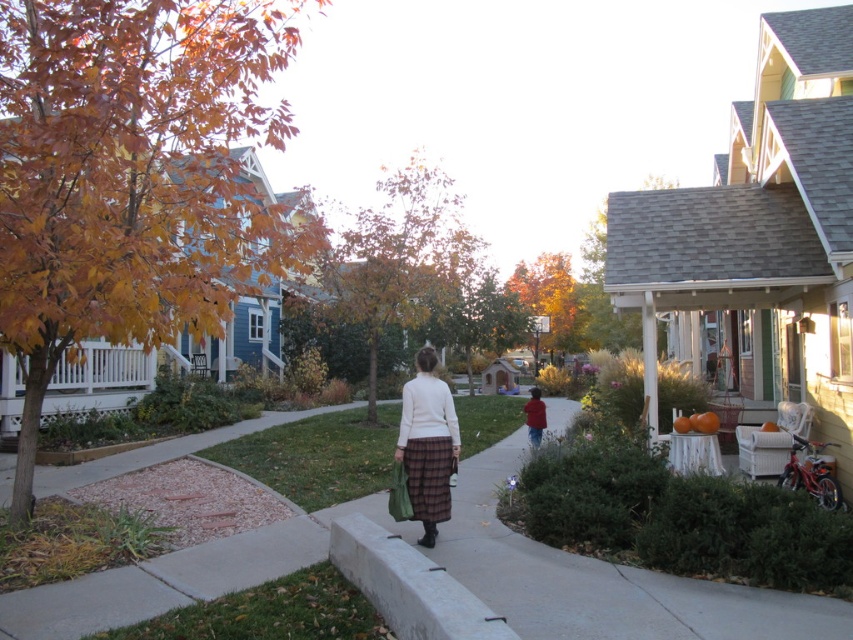
Which of these two, white concrete curb at lower center or white wool sweater at center, stands shorter?

white concrete curb at lower center is shorter.

What do you see at coordinates (408, 586) in the screenshot? I see `white concrete curb at lower center` at bounding box center [408, 586].

The height and width of the screenshot is (640, 853). I want to click on white concrete curb at lower center, so click(408, 586).

Is white concrete curb at lower center below red cotton shirt at center?

No, white concrete curb at lower center is not below red cotton shirt at center.

What do you see at coordinates (408, 586) in the screenshot? I see `white concrete curb at lower center` at bounding box center [408, 586].

Image resolution: width=853 pixels, height=640 pixels. Identify the location of white concrete curb at lower center. (408, 586).

Who is lower down, white wool sweater at center or red cotton shirt at center?

red cotton shirt at center is below.

Between white wool sweater at center and red cotton shirt at center, which one is positioned higher?

white wool sweater at center

Is point (447, 388) closer to viewer compared to point (529, 438)?

That is True.

What are the coordinates of `white wool sweater at center` in the screenshot? It's located at (427, 444).